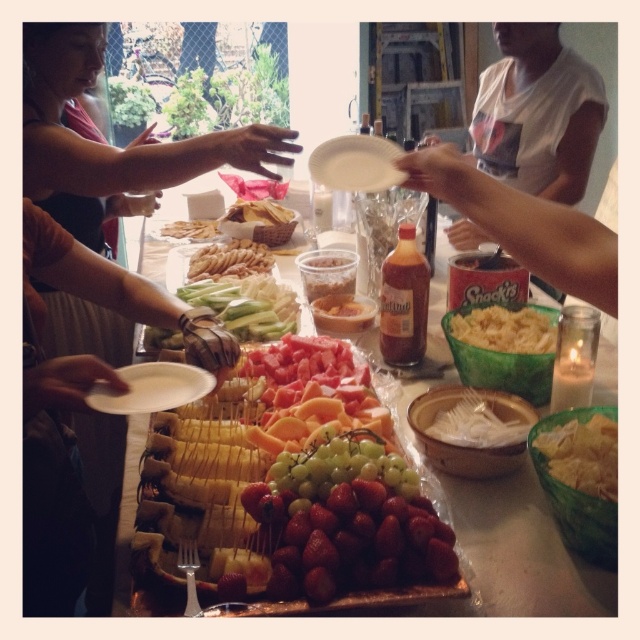
You are at the party and want to move from the entrance to the snack table. You see two points marked on the floor, point 1 at coordinates point 1 is at point (502, 330) and point 2 is at point (173, 237). Which point is closer to the entrance?

Point 2 at coordinates point (173, 237) is closer to the entrance because it is behind point 1 at coordinates point (502, 330), which is in front of it.

You are standing at the point marked as point (550, 342) and want to reach the window to get a better view outside. The distance between you and the window is 1.10 meters. If your walking speed is 0.5 meters per second, how many seconds will it take you to reach the window?

The distance between you and the window is 1.10 meters. At a speed of 0.5 meters per second, it will take 2.2 seconds to reach the window.